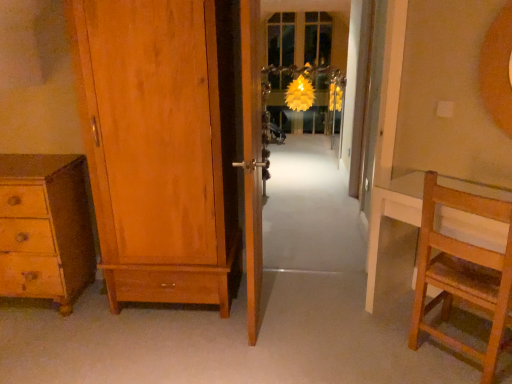
Question: From the image's perspective, does translucent glass screen door at center appear higher than white carpet at center, which appears as the 1th path when viewed from the back?

Choices:
 (A) no
 (B) yes

Answer: (A)

Question: Could white carpet at center, which is counted as the 2th path, starting from the front, be considered to be inside translucent glass screen door at center?

Choices:
 (A) yes
 (B) no

Answer: (B)

Question: Is translucent glass screen door at center placed right next to white carpet at center, which appears as the 1th path when viewed from the back?

Choices:
 (A) no
 (B) yes

Answer: (A)

Question: Is translucent glass screen door at center positioned in front of white carpet at center, which is the 2th path from bottom to top?

Choices:
 (A) yes
 (B) no

Answer: (A)

Question: Is translucent glass screen door at center further to camera compared to white carpet at center, the first path from the top?

Choices:
 (A) yes
 (B) no

Answer: (B)

Question: Considering the relative positions of wooden floor at center, the first path when ordered from bottom to top, and wooden door at center, acting as the second door starting from the left, in the image provided, is wooden floor at center, the first path when ordered from bottom to top, to the left or to the right of wooden door at center, acting as the second door starting from the left,?

Choices:
 (A) right
 (B) left

Answer: (B)

Question: From a real-world perspective, is wooden floor at center, arranged as the 2th path when viewed from the back, physically located above or below wooden door at center, the 1th door in the right-to-left sequence?

Choices:
 (A) above
 (B) below

Answer: (B)

Question: Based on their sizes in the image, would you say wooden floor at center, marked as the 1th path in a front-to-back arrangement, is bigger or smaller than wooden door at center, the 1th door in the right-to-left sequence?

Choices:
 (A) big
 (B) small

Answer: (B)

Question: From the image's perspective, is wooden floor at center, the second path when ordered from top to bottom, above or below wooden door at center, acting as the second door starting from the left?

Choices:
 (A) below
 (B) above

Answer: (A)

Question: Considering the positions of wooden chest of drawers at lower left and white carpet at center, which appears as the 1th path when viewed from the back, in the image, is wooden chest of drawers at lower left wider or thinner than white carpet at center, which appears as the 1th path when viewed from the back,?

Choices:
 (A) thin
 (B) wide

Answer: (A)

Question: Is wooden chest of drawers at lower left in front of or behind white carpet at center, the first path from the top, in the image?

Choices:
 (A) front
 (B) behind

Answer: (A)

Question: Is point (68, 185) closer or farther from the camera than point (329, 253)?

Choices:
 (A) closer
 (B) farther

Answer: (A)

Question: Considering the positions of wooden chest of drawers at lower left and white carpet at center, which is counted as the 2th path, starting from the front, in the image, is wooden chest of drawers at lower left taller or shorter than white carpet at center, which is counted as the 2th path, starting from the front,?

Choices:
 (A) short
 (B) tall

Answer: (B)

Question: Is translucent glass screen door at center wider or thinner than wooden door at center, acting as the second door starting from the left?

Choices:
 (A) wide
 (B) thin

Answer: (B)

Question: Considering the positions of point tap(283, 4) and point tap(260, 54), is point tap(283, 4) closer or farther from the camera than point tap(260, 54)?

Choices:
 (A) farther
 (B) closer

Answer: (A)